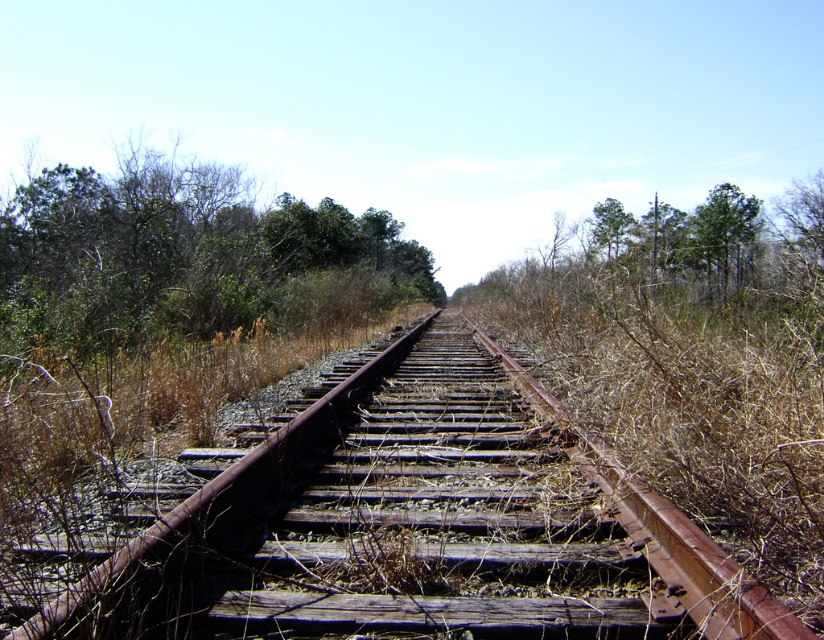
Question: Is green leafy trees at upper center closer to the viewer compared to green leafy tree at upper right?

Choices:
 (A) yes
 (B) no

Answer: (A)

Question: Is rusty metal train track at center wider than green leafy trees at upper center?

Choices:
 (A) yes
 (B) no

Answer: (B)

Question: In this image, where is green leafy trees at upper center located relative to green leafy tree at upper right?

Choices:
 (A) left
 (B) right

Answer: (A)

Question: Among these points, which one is nearest to the camera?

Choices:
 (A) (279, 298)
 (B) (431, 508)
 (C) (714, 196)

Answer: (B)

Question: Which object is farther from the camera taking this photo?

Choices:
 (A) rusty metal train track at center
 (B) green leafy tree at upper right

Answer: (B)

Question: Which object is farther from the camera taking this photo?

Choices:
 (A) green leafy trees at upper center
 (B) green leafy tree at upper right
 (C) rusty metal train track at center

Answer: (B)